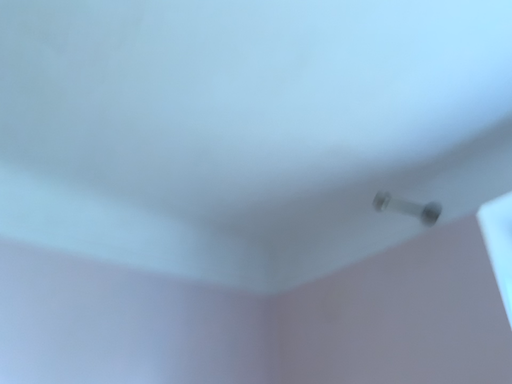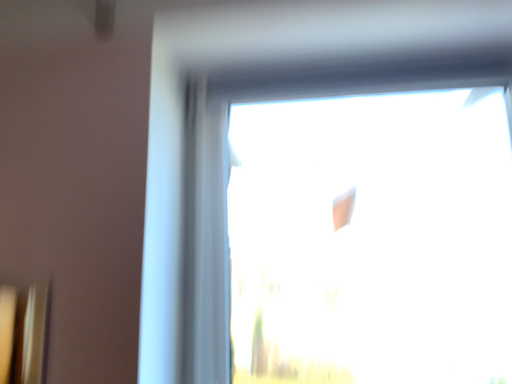
Question: Which way did the camera rotate in the video?

Choices:
 (A) rotated downward
 (B) rotated upward

Answer: (A)